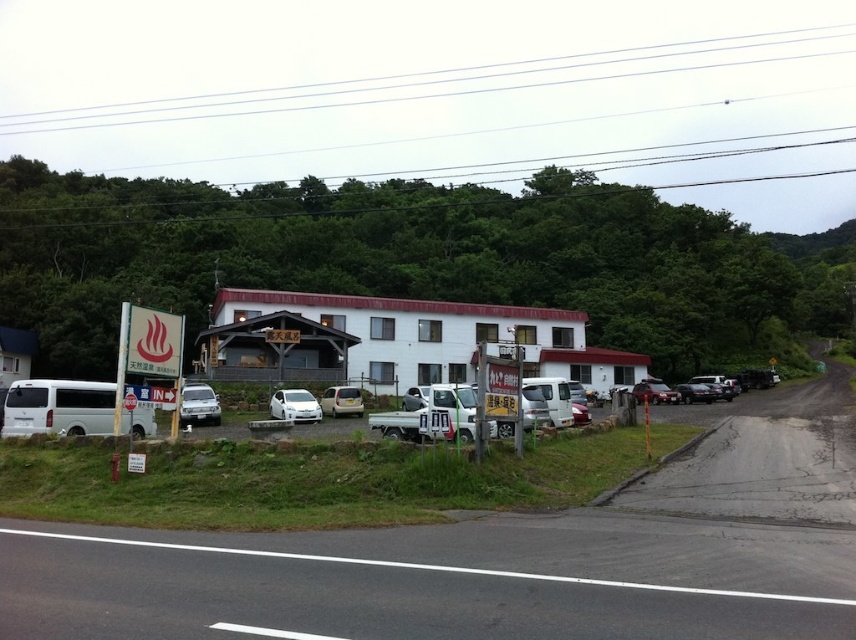
Question: Can you confirm if white matte car at lower left is wider than matte silver van at center?

Choices:
 (A) no
 (B) yes

Answer: (A)

Question: Which object is closer to the camera taking this photo?

Choices:
 (A) shiny red sedan at right
 (B) white matte car at lower left
 (C) matte silver van at center

Answer: (B)

Question: In this image, where is matte silver van at center located relative to shiny black sedan at right?

Choices:
 (A) below
 (B) above

Answer: (B)

Question: Does white matte car at lower left appear on the right side of shiny black sedan at right?

Choices:
 (A) yes
 (B) no

Answer: (B)

Question: Which point is farther to the camera?

Choices:
 (A) shiny red sedan at right
 (B) matte silver van at center
 (C) white matte car at center

Answer: (A)

Question: Which of the following is the farthest from the observer?

Choices:
 (A) (645, 387)
 (B) (700, 401)

Answer: (A)